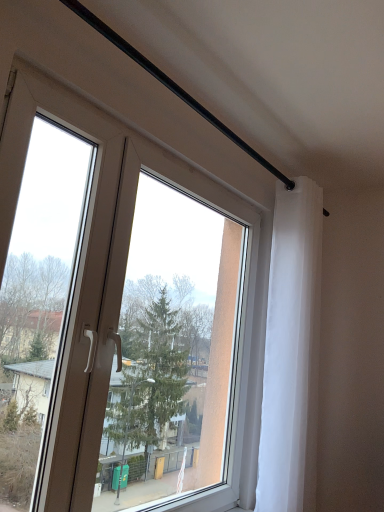
Question: Is the position of transparent glass window at center less distant than that of white sheer curtain at upper right?

Choices:
 (A) yes
 (B) no

Answer: (A)

Question: Can you confirm if transparent glass window at center is shorter than white sheer curtain at upper right?

Choices:
 (A) yes
 (B) no

Answer: (A)

Question: Is white sheer curtain at upper right located within transparent glass window at center?

Choices:
 (A) yes
 (B) no

Answer: (B)

Question: Does transparent glass window at center turn towards white sheer curtain at upper right?

Choices:
 (A) no
 (B) yes

Answer: (B)

Question: Is transparent glass window at center at the right side of white sheer curtain at upper right?

Choices:
 (A) yes
 (B) no

Answer: (B)

Question: From a real-world perspective, is transparent glass window at center physically below white sheer curtain at upper right?

Choices:
 (A) no
 (B) yes

Answer: (B)

Question: Does white sheer curtain at upper right have a larger size compared to transparent glass window at center?

Choices:
 (A) yes
 (B) no

Answer: (B)

Question: Is white sheer curtain at upper right not close to transparent glass window at center?

Choices:
 (A) no
 (B) yes

Answer: (A)

Question: Is white sheer curtain at upper right wider than transparent glass window at center?

Choices:
 (A) no
 (B) yes

Answer: (B)

Question: Is white sheer curtain at upper right completely or partially outside of transparent glass window at center?

Choices:
 (A) no
 (B) yes

Answer: (B)

Question: Can transparent glass window at center be found inside white sheer curtain at upper right?

Choices:
 (A) no
 (B) yes

Answer: (A)

Question: Considering the relative positions of white sheer curtain at upper right and transparent glass window at center in the image provided, is white sheer curtain at upper right to the right of transparent glass window at center from the viewer's perspective?

Choices:
 (A) yes
 (B) no

Answer: (A)

Question: From a real-world perspective, is transparent glass window at center physically located above or below white sheer curtain at upper right?

Choices:
 (A) below
 (B) above

Answer: (A)